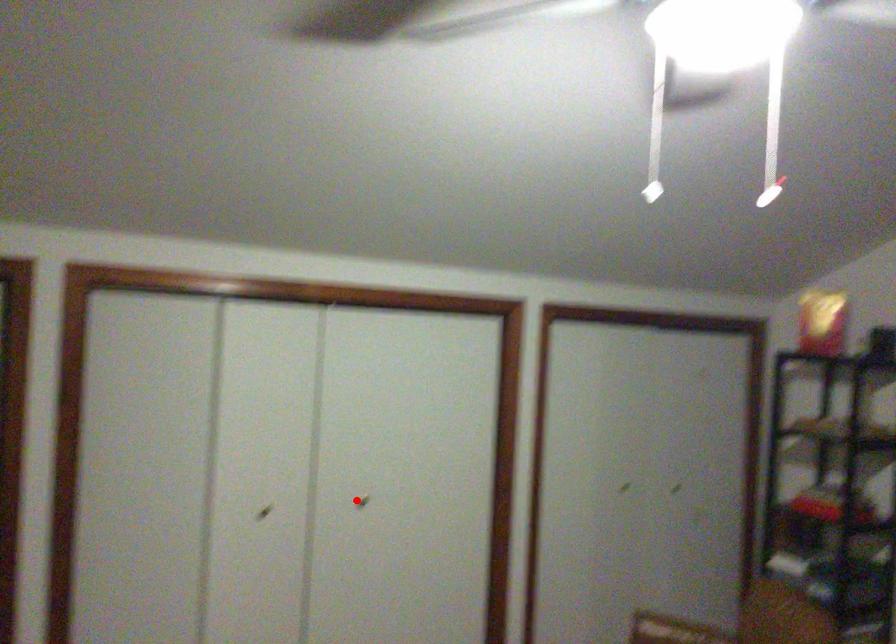
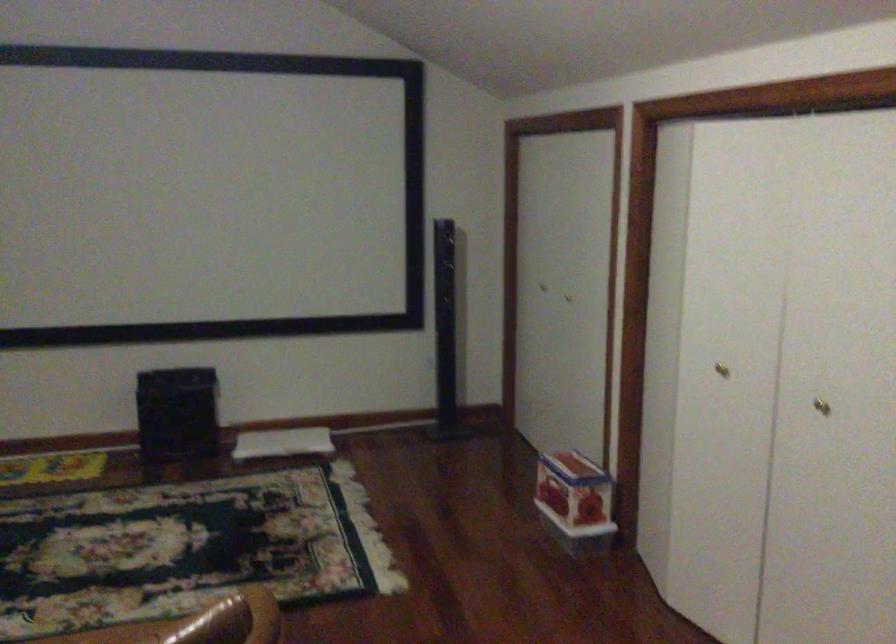
Question: I am providing you with two images of the same scene from different viewpoints. In image1, a red point is highlighted. Considering the same 3D point in image2, which of the following is correct?

Choices:
 (A) It is closer
 (B) It is farther

Answer: (A)